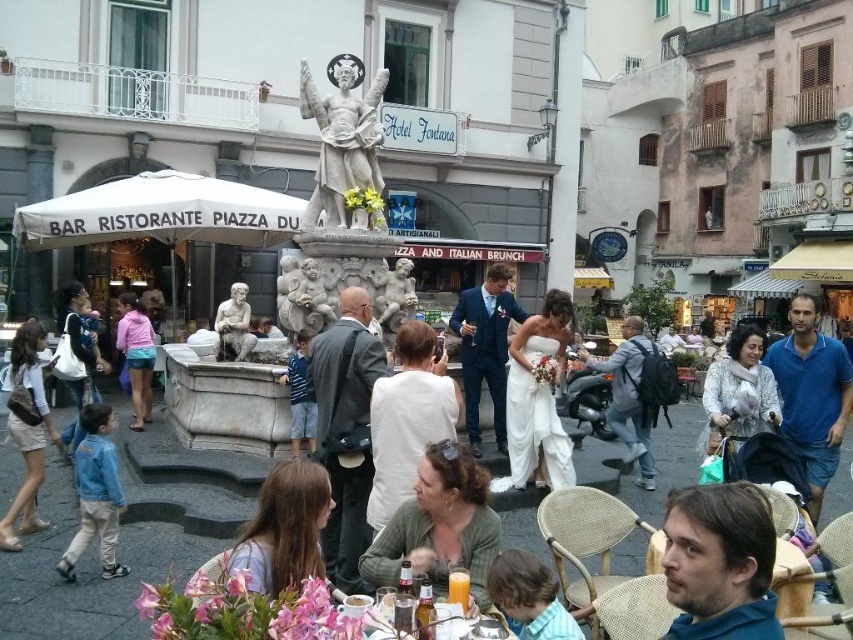
Can you confirm if striped shirt at center is positioned above marble statue at center?

Actually, striped shirt at center is below marble statue at center.

Is point (296, 346) in front of point (238, 314)?

That is True.

Is point (310, 440) positioned behind point (219, 316)?

No, it is not.

The width and height of the screenshot is (853, 640). Find the location of `striped shirt at center`. striped shirt at center is located at coordinates (300, 394).

Is white satin dress at center wider than denim jacket at lower left?

Correct, the width of white satin dress at center exceeds that of denim jacket at lower left.

Who is higher up, white satin dress at center or denim jacket at lower left?

white satin dress at center is above.

The height and width of the screenshot is (640, 853). In order to click on white satin dress at center in this screenshot , I will do `click(538, 397)`.

Does white satin dress at center have a larger size compared to light brown hair at lower center?

Yes, white satin dress at center is bigger than light brown hair at lower center.

Can you confirm if white satin dress at center is taller than light brown hair at lower center?

Indeed, white satin dress at center has a greater height compared to light brown hair at lower center.

Does point (531, 456) come farther from viewer compared to point (544, 582)?

That is True.

Identify the location of white satin dress at center. (538, 397).